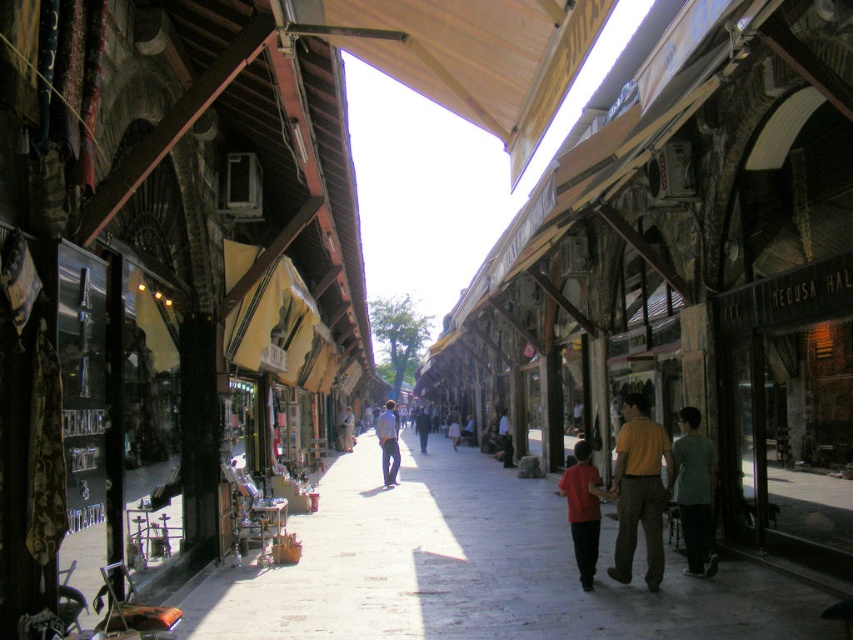
Who is lower down, matte red shirt at center or dark blue jeans at center?

dark blue jeans at center is lower down.

Does matte red shirt at center have a lesser width compared to dark blue jeans at center?

Yes, matte red shirt at center is thinner than dark blue jeans at center.

Who is more forward, [593,548] or [500,417]?

Point [593,548] is in front.

The height and width of the screenshot is (640, 853). What are the coordinates of `matte red shirt at center` in the screenshot? It's located at click(583, 509).

Which of these two, gray cotton shirt at center or light brown leather jacket at center, stands shorter?

Standing shorter between the two is gray cotton shirt at center.

Can you confirm if gray cotton shirt at center is positioned to the left of light brown leather jacket at center?

Incorrect, gray cotton shirt at center is not on the left side of light brown leather jacket at center.

Is point (699, 531) positioned before point (343, 448)?

Yes.

Locate an element on the screen. The width and height of the screenshot is (853, 640). gray cotton shirt at center is located at coordinates (695, 492).

Which is behind, point (384, 435) or point (347, 444)?

Point (347, 444)

The height and width of the screenshot is (640, 853). Describe the element at coordinates (387, 442) in the screenshot. I see `light blue denim jeans at center` at that location.

You are a GUI agent. You are given a task and a screenshot of the screen. Output one action in this format:
    pyautogui.click(x=<x>, y=<y>)
    Task: Click on the light blue denim jeans at center
    The width and height of the screenshot is (853, 640).
    Given the screenshot: What is the action you would take?
    pyautogui.click(x=387, y=442)